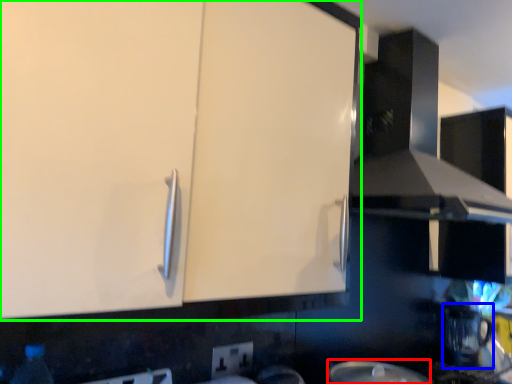
Question: Which object is the farthest from appliance (highlighted by a red box)? Choose among these: coffee machine (highlighted by a blue box) or cabinetry (highlighted by a green box).

Choices:
 (A) coffee machine
 (B) cabinetry

Answer: (A)